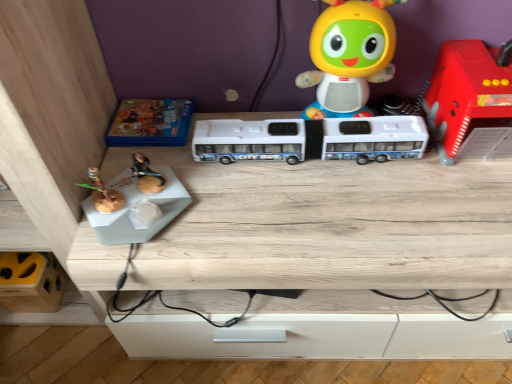
This screenshot has width=512, height=384. Find the location of `free spot below rubberized red fire truck at right, the 5th toy positioned from the left (from a real-world perspective)`. free spot below rubberized red fire truck at right, the 5th toy positioned from the left (from a real-world perspective) is located at coordinates (484, 141).